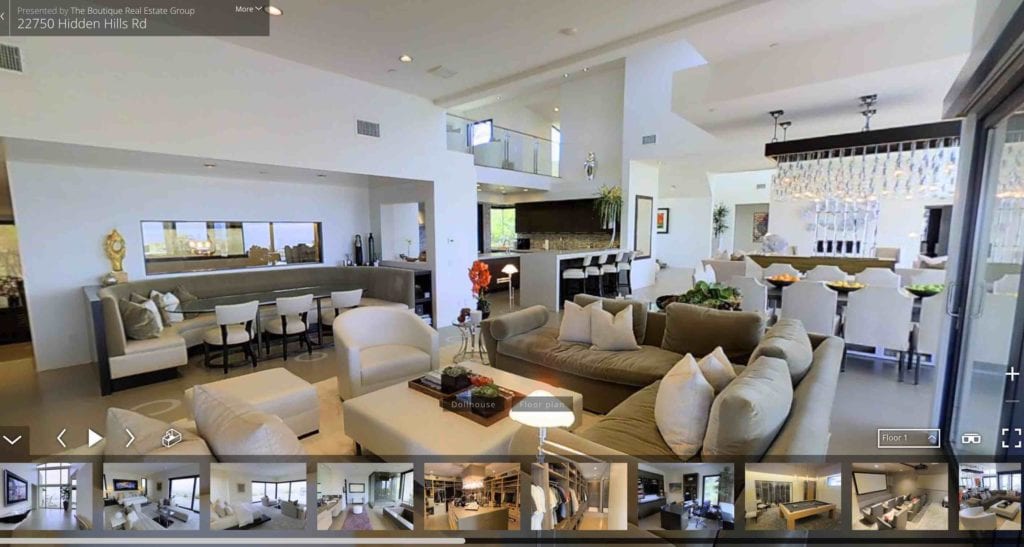
At what (x,y) coordinates should I click in order to perform the action: click on dining table. Please return your answer as a coordinate pair (x, y). The image size is (1024, 547). Looking at the image, I should click on coord(210,300).